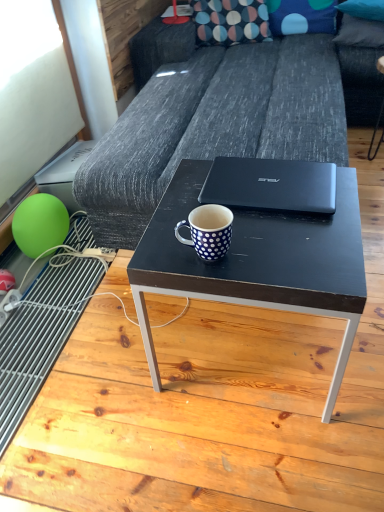
Where is `vacant area on top of black matte laptop at center (from a real-world perspective)`? vacant area on top of black matte laptop at center (from a real-world perspective) is located at coordinates (271, 176).